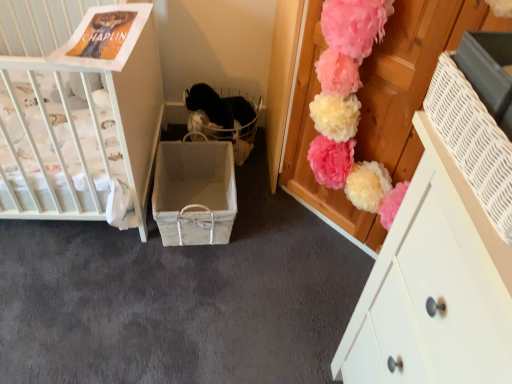
Question: Considering the relative sizes of white painted wood cabinet at upper right and white wicker basket at right, marked as the 1th storage box in a right-to-left arrangement, in the image provided, is white painted wood cabinet at upper right thinner than white wicker basket at right, marked as the 1th storage box in a right-to-left arrangement,?

Choices:
 (A) no
 (B) yes

Answer: (A)

Question: Does white painted wood cabinet at upper right have a lesser height compared to white wicker basket at right, which appears as the first storage box when viewed from the front?

Choices:
 (A) no
 (B) yes

Answer: (A)

Question: Is white painted wood cabinet at upper right taller than white wicker basket at right, which appears as the first storage box when viewed from the front?

Choices:
 (A) yes
 (B) no

Answer: (A)

Question: Are white painted wood cabinet at upper right and white wicker basket at right, which appears as the first storage box when viewed from the front, making contact?

Choices:
 (A) no
 (B) yes

Answer: (A)

Question: Does white painted wood cabinet at upper right come behind white wicker basket at right, placed as the second storage box when sorted from left to right?

Choices:
 (A) yes
 (B) no

Answer: (A)

Question: Looking at their shapes, would you say white wicker basket at right, which appears as the first storage box when viewed from the front, is wider or thinner than black wicker basket at center?

Choices:
 (A) thin
 (B) wide

Answer: (A)

Question: Would you say white wicker basket at right, placed as the second storage box when sorted from left to right, is to the left or to the right of black wicker basket at center in the picture?

Choices:
 (A) left
 (B) right

Answer: (B)

Question: Is point (434, 89) closer or farther from the camera than point (218, 114)?

Choices:
 (A) farther
 (B) closer

Answer: (B)

Question: Is white wicker basket at right, marked as the 1th storage box in a right-to-left arrangement, spatially inside black wicker basket at center, or outside of it?

Choices:
 (A) inside
 (B) outside

Answer: (B)

Question: Do you think white painted wood cabinet at upper right is within white wicker basket at right, which is the 2th storage box from back to front, or outside of it?

Choices:
 (A) inside
 (B) outside

Answer: (B)

Question: In terms of height, does white painted wood cabinet at upper right look taller or shorter compared to white wicker basket at right, which is the 2th storage box from back to front?

Choices:
 (A) tall
 (B) short

Answer: (A)

Question: From the image's perspective, relative to white wicker basket at right, marked as the 1th storage box in a right-to-left arrangement, is white painted wood cabinet at upper right above or below?

Choices:
 (A) above
 (B) below

Answer: (B)

Question: In the image, is white painted wood cabinet at upper right positioned in front of or behind white wicker basket at right, which appears as the first storage box when viewed from the front?

Choices:
 (A) behind
 (B) front

Answer: (A)

Question: From a real-world perspective, is white painted wood cabinet at upper right positioned above or below white wicker basket at center, the first storage box in the left-to-right sequence?

Choices:
 (A) above
 (B) below

Answer: (A)

Question: From the image's perspective, relative to white wicker basket at center, which is the first storage box from back to front, is white painted wood cabinet at upper right above or below?

Choices:
 (A) below
 (B) above

Answer: (A)